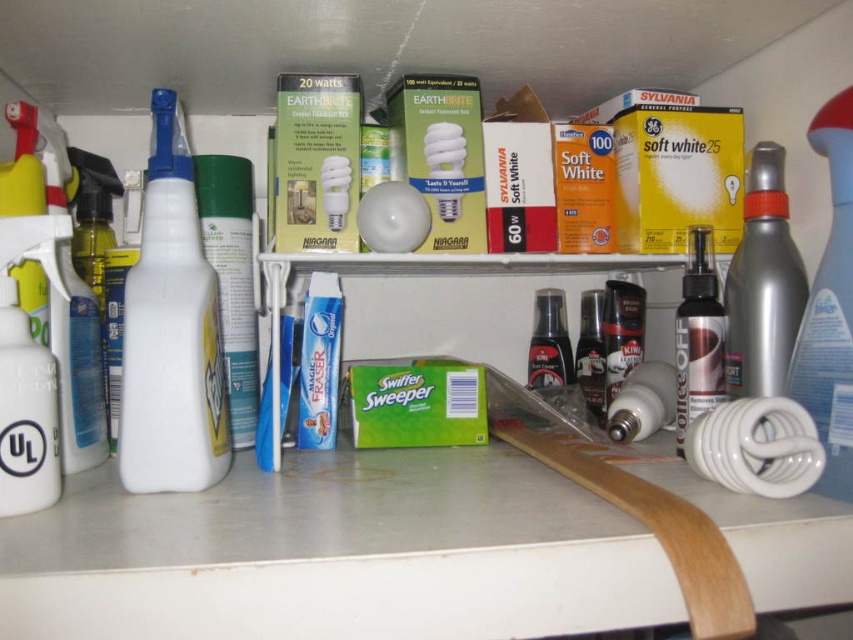
Question: Where is satin silver bulb at center located in relation to metallic spray can at center-right in the image?

Choices:
 (A) below
 (B) above

Answer: (A)

Question: Is white glossy counter top at lower center positioned at the back of brown translucent spray bottle at center-right?

Choices:
 (A) yes
 (B) no

Answer: (B)

Question: Is white glossy counter top at lower center closer to camera compared to white plastic spray bottle at left?

Choices:
 (A) yes
 (B) no

Answer: (A)

Question: Which point is closer to the camera?

Choices:
 (A) (630, 406)
 (B) (688, 282)

Answer: (B)

Question: Which of the following is the closest to the observer?

Choices:
 (A) satin silver bulb at center
 (B) metallic spray can at center-right
 (C) white glossy counter top at lower center
 (D) black glossy spray bottle at center

Answer: (C)

Question: Which of the following is the farthest from the observer?

Choices:
 (A) brown translucent spray bottle at center-right
 (B) white matte spray bottle at left

Answer: (B)